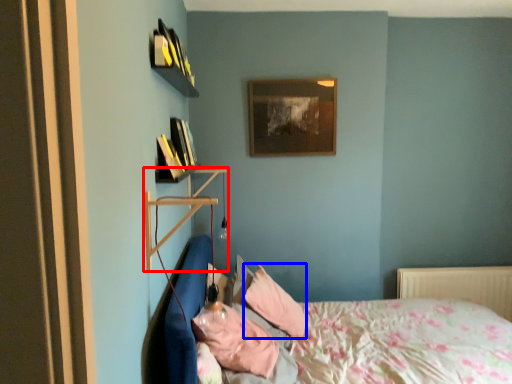
Question: Which point is further to the camera, shelf (highlighted by a red box) or pillow (highlighted by a blue box)?

Choices:
 (A) shelf
 (B) pillow

Answer: (B)